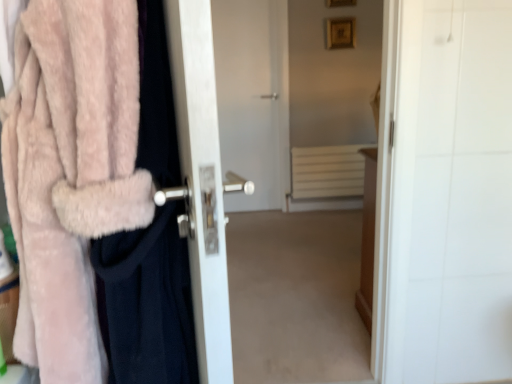
Question: Is fuzzy pink coat at left facing towards white matte radiator at center?

Choices:
 (A) yes
 (B) no

Answer: (B)

Question: Would you say fuzzy pink coat at left is outside white matte radiator at center?

Choices:
 (A) no
 (B) yes

Answer: (B)

Question: From a real-world perspective, is fuzzy pink coat at left over white matte radiator at center?

Choices:
 (A) no
 (B) yes

Answer: (B)

Question: Can you confirm if fuzzy pink coat at left is smaller than white matte radiator at center?

Choices:
 (A) no
 (B) yes

Answer: (A)

Question: Is the depth of fuzzy pink coat at left less than that of white matte radiator at center?

Choices:
 (A) no
 (B) yes

Answer: (B)

Question: From a real-world perspective, relative to fuzzy pink coat at left, is white glossy door handle at left vertically above or below?

Choices:
 (A) above
 (B) below

Answer: (B)

Question: Considering the positions of white glossy door handle at left and fuzzy pink coat at left in the image, is white glossy door handle at left wider or thinner than fuzzy pink coat at left?

Choices:
 (A) wide
 (B) thin

Answer: (A)

Question: Do you think white glossy door handle at left is within fuzzy pink coat at left, or outside of it?

Choices:
 (A) outside
 (B) inside

Answer: (A)

Question: Based on their positions, is white glossy door handle at left located to the left or right of fuzzy pink coat at left?

Choices:
 (A) right
 (B) left

Answer: (A)

Question: From a real-world perspective, relative to white matte radiator at center, is fuzzy pink coat at left vertically above or below?

Choices:
 (A) above
 (B) below

Answer: (A)

Question: Based on their positions, is fuzzy pink coat at left located to the left or right of white matte radiator at center?

Choices:
 (A) right
 (B) left

Answer: (B)

Question: Is fuzzy pink coat at left bigger or smaller than white matte radiator at center?

Choices:
 (A) small
 (B) big

Answer: (B)

Question: Do you think fuzzy pink coat at left is within white matte radiator at center, or outside of it?

Choices:
 (A) outside
 (B) inside

Answer: (A)

Question: From a real-world perspective, is fuzzy pink coat at left positioned above or below fuzzy pink coat at left?

Choices:
 (A) above
 (B) below

Answer: (B)

Question: Would you say fuzzy pink coat at left is to the left or to the right of fuzzy pink coat at left in the picture?

Choices:
 (A) right
 (B) left

Answer: (A)